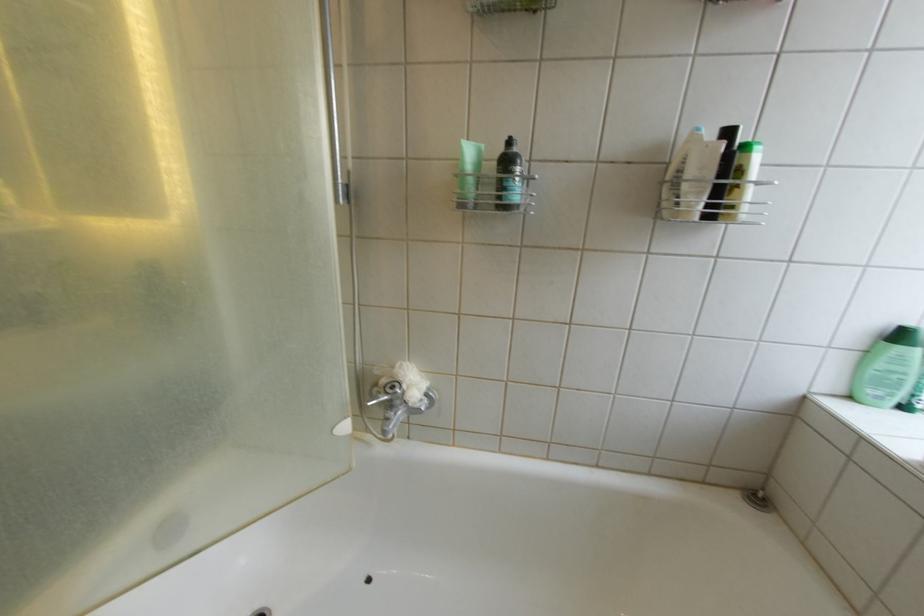
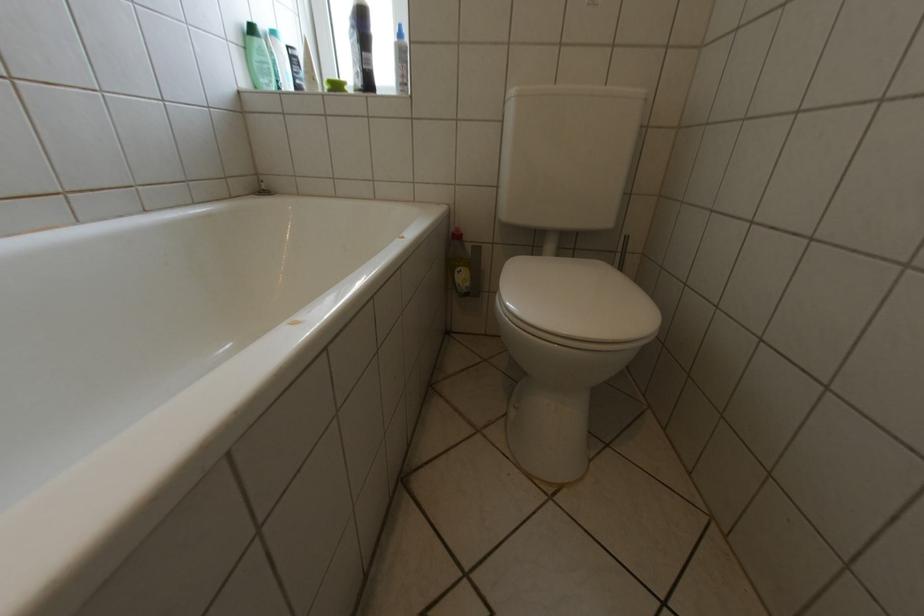
In the second image, find the point that corresponds to pixel 893 367 in the first image.

(268, 59)